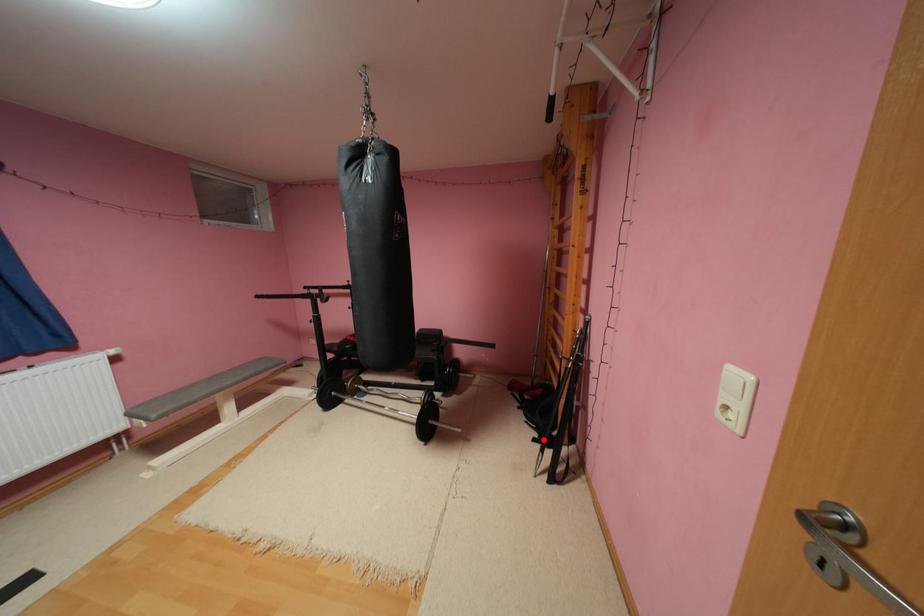
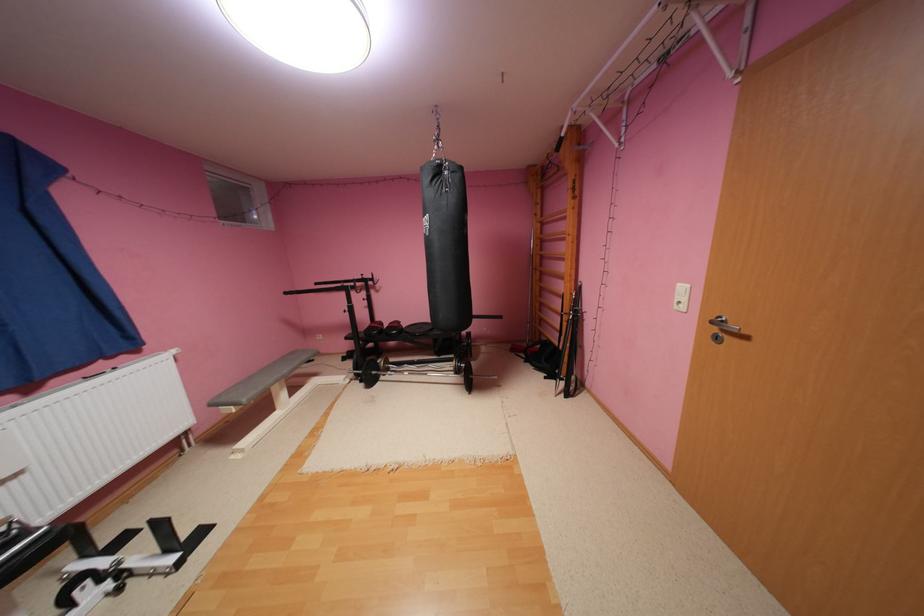
Question: A red point is marked in image1. In image2, is the corresponding 3D point closer to the camera or farther? Reply with the corresponding letter.

Choices:
 (A) The corresponding 3D point is closer.
 (B) The corresponding 3D point is farther.

Answer: (B)